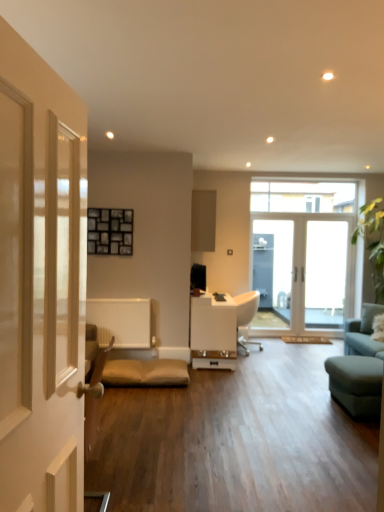
Question: Is white plastic chair at center wider or thinner than transparent glass door at center?

Choices:
 (A) thin
 (B) wide

Answer: (B)

Question: Considering the positions of point click(238, 301) and point click(316, 274), is point click(238, 301) closer or farther from the camera than point click(316, 274)?

Choices:
 (A) closer
 (B) farther

Answer: (A)

Question: Considering the real-world distances, which object is closest to the matte wood cabinet at center?

Choices:
 (A) white plastic chair at center
 (B) white glossy table at center
 (C) transparent glass door at center
 (D) clear glass window at upper center, which is the second window in bottom-to-top order
 (E) white glass door at center, the 2th window when ordered from top to bottom

Answer: (A)

Question: Estimate the real-world distances between objects in this image. Which object is farther from the white glossy door at left?

Choices:
 (A) clear glass window at upper center, which is the 1th window from top to bottom
 (B) matte wood cabinet at center
 (C) teal fabric studio couch at right
 (D) white glossy table at center
 (E) transparent glass door at center

Answer: (A)